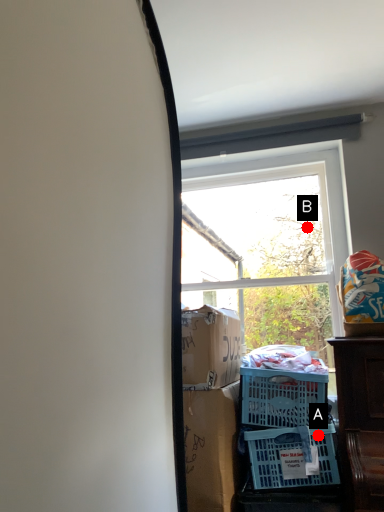
Question: Two points are circled on the image, labeled by A and B beside each circle. Which point is farther to the camera?

Choices:
 (A) A is further
 (B) B is further

Answer: (B)